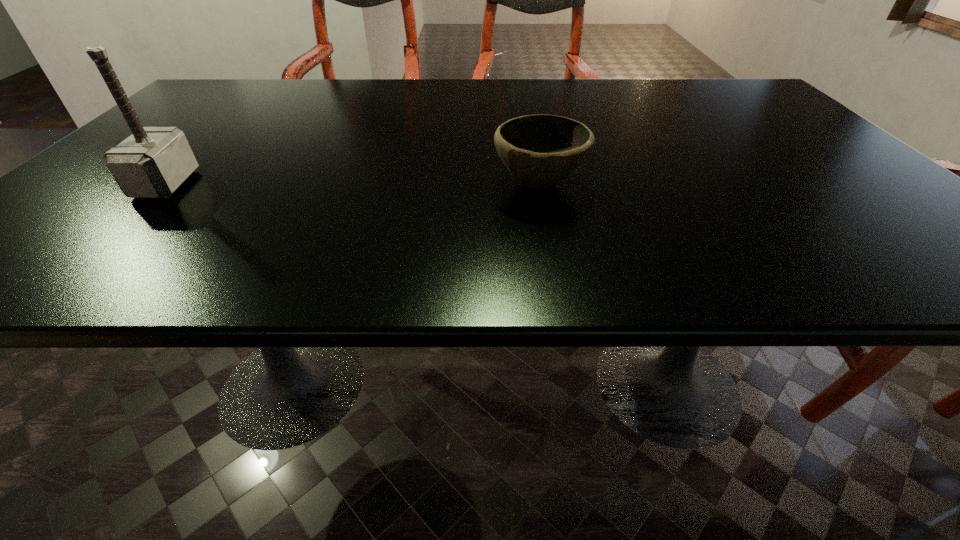
Locate an element on the screen. Image resolution: width=960 pixels, height=540 pixels. free point that satisfies the following two spatial constraints: 1. on the back side of the right object; 2. for striking with the head of the hammer is located at coordinates (540, 184).

This screenshot has height=540, width=960. Find the location of `free space that satisfies the following two spatial constraints: 1. on the back side of the shorter object; 2. for striking with the head of the hammer`. free space that satisfies the following two spatial constraints: 1. on the back side of the shorter object; 2. for striking with the head of the hammer is located at coordinates pyautogui.click(x=540, y=184).

Locate an element on the screen. This screenshot has height=540, width=960. free point that satisfies the following two spatial constraints: 1. for striking with the head of the taller object; 2. on the back side of the bowl is located at coordinates (166, 184).

This screenshot has width=960, height=540. What are the coordinates of `vacant position in the image that satisfies the following two spatial constraints: 1. for striking with the head of the taller object; 2. on the back side of the bowl` in the screenshot? It's located at (166, 184).

Find the location of `free location that satisfies the following two spatial constraints: 1. for striking with the head of the hammer; 2. on the right side of the bowl`. free location that satisfies the following two spatial constraints: 1. for striking with the head of the hammer; 2. on the right side of the bowl is located at coordinates (166, 184).

Locate an element on the screen. vacant region that satisfies the following two spatial constraints: 1. on the back side of the bowl; 2. for striking with the head of the hammer is located at coordinates click(540, 184).